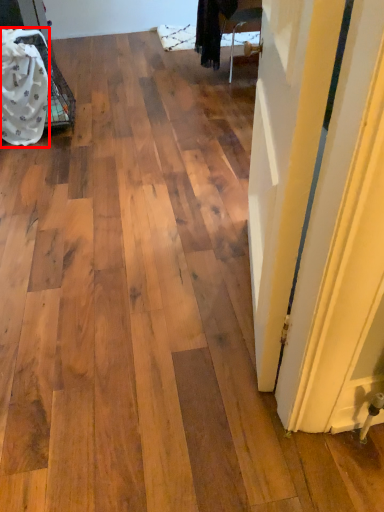
Question: From the image's perspective, where is material (annotated by the red box) located in relation to door in the image?

Choices:
 (A) below
 (B) above

Answer: (B)